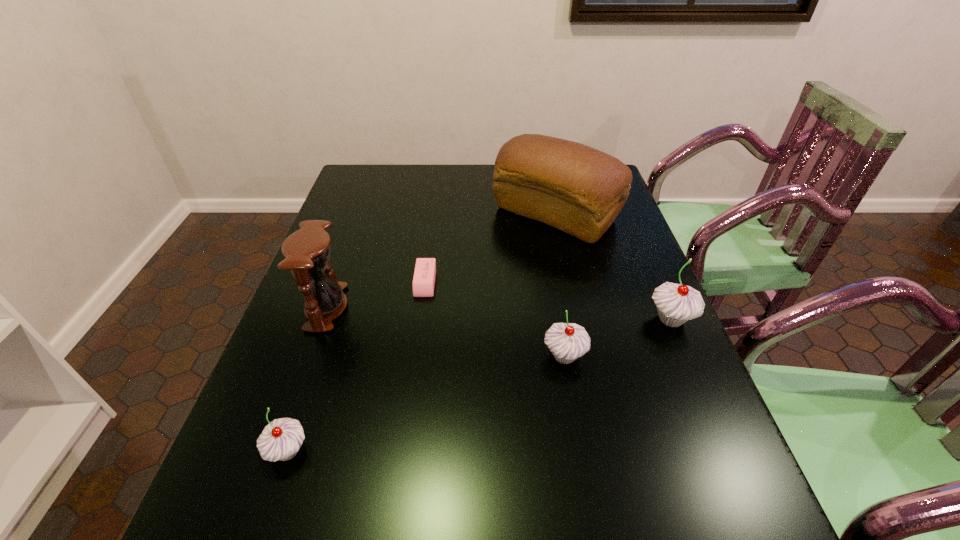
Identify the location of free space located on the left of the second farthest cupcake. (502, 356).

Locate an element on the screen. free space located 0.140m on the front of the rightmost cupcake is located at coordinates (701, 389).

You are a GUI agent. You are given a task and a screenshot of the screen. Output one action in this format:
    pyautogui.click(x=<x>, y=<y>)
    Task: Click on the blank space located 0.300m on the front of the eraser
    This screenshot has width=960, height=540.
    Given the screenshot: What is the action you would take?
    pyautogui.click(x=409, y=400)

I want to click on vacant space located on the back of the farthest object, so click(x=547, y=178).

This screenshot has width=960, height=540. What are the coordinates of `free location located 0.340m on the right of the hourglass` in the screenshot? It's located at (484, 308).

I want to click on object located at the far edge, so click(x=575, y=188).

Where is `object that is at the near edge`? object that is at the near edge is located at coordinates click(x=281, y=439).

Where is `cupcake at the left edge`? The height and width of the screenshot is (540, 960). cupcake at the left edge is located at coordinates (281, 439).

This screenshot has height=540, width=960. I want to click on hourglass that is at the left edge, so click(307, 251).

Image resolution: width=960 pixels, height=540 pixels. What are the coordinates of `cupcake located at the right edge` in the screenshot? It's located at (676, 304).